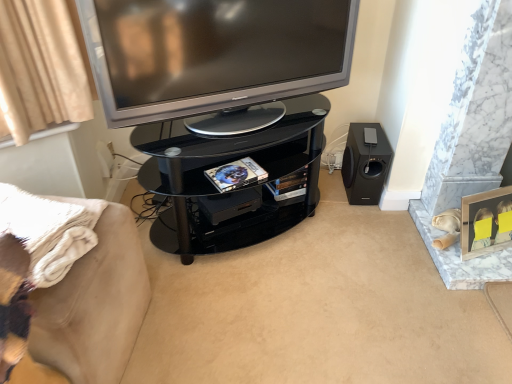
What is the approximate width of black matte speaker at lower right?

It is 33.46 centimeters.

Find the location of a particular element. black matte speaker at lower right is located at coordinates (365, 163).

Who is shorter, silver metallic television at upper center or black glass tv cabinet at center?

Standing shorter between the two is silver metallic television at upper center.

Considering the positions of objects silver metallic television at upper center and black glass tv cabinet at center in the image provided, who is more to the left, silver metallic television at upper center or black glass tv cabinet at center?

black glass tv cabinet at center.

Which is closer, (156, 45) or (313, 190)?

The point (156, 45) is in front.

Can you confirm if black glass tv cabinet at center is positioned to the left of beige fabric couch at lower left?

In fact, black glass tv cabinet at center is to the right of beige fabric couch at lower left.

Which point is more forward, (x=165, y=159) or (x=58, y=219)?

The point (x=58, y=219) is more forward.

From the picture: From a real-world perspective, is black glass tv cabinet at center physically above beige fabric couch at lower left?

Correct, in the physical world, black glass tv cabinet at center is higher than beige fabric couch at lower left.

Based on the photo, how different are the orientations of black glass tv cabinet at center and beige fabric couch at lower left in degrees?

The angular difference between black glass tv cabinet at center and beige fabric couch at lower left is 57.5 degrees.

Is black glass tv cabinet at center bigger or smaller than silver metallic television at upper center?

black glass tv cabinet at center is bigger than silver metallic television at upper center.

Is black glass tv cabinet at center aimed at silver metallic television at upper center?

No, black glass tv cabinet at center is not oriented towards silver metallic television at upper center.

What's the angular difference between black glass tv cabinet at center and silver metallic television at upper center's facing directions?

1.93 degrees separate the facing orientations of black glass tv cabinet at center and silver metallic television at upper center.

Measure the distance between black glass tv cabinet at center and silver metallic television at upper center.

They are 10.38 inches apart.

Considering the positions of point (339, 71) and point (366, 155), is point (339, 71) closer or farther from the camera than point (366, 155)?

Point (339, 71) appears to be closer to the viewer than point (366, 155).

From the picture: From a real-world perspective, is silver metallic television at upper center physically above black matte speaker at lower right?

Indeed, from a real-world perspective, silver metallic television at upper center stands above black matte speaker at lower right.

How different are the orientations of silver metallic television at upper center and black matte speaker at lower right in degrees?

The angle between the facing direction of silver metallic television at upper center and the facing direction of black matte speaker at lower right is 22.1 degrees.

From the picture: Is beige fabric couch at lower left far away from black matte speaker at lower right?

Indeed, beige fabric couch at lower left is not near black matte speaker at lower right.

How different are the orientations of beige fabric couch at lower left and black matte speaker at lower right in degrees?

The angle between the facing direction of beige fabric couch at lower left and the facing direction of black matte speaker at lower right is 81.6 degrees.

From the image's perspective, relative to black matte speaker at lower right, is beige fabric couch at lower left above or below?

Based on their image positions, beige fabric couch at lower left is located beneath black matte speaker at lower right.

How many degrees apart are the facing directions of beige fabric couch at lower left and black glass tv cabinet at center?

57.5 degrees.

Considering the points (94, 201) and (192, 144), which point is in front, point (94, 201) or point (192, 144)?

The point (94, 201) is more forward.

Identify the location of furniture that is in front of the black glass tv cabinet at center. (71, 287).

Can you confirm if beige fabric couch at lower left is smaller than black glass tv cabinet at center?

Indeed, beige fabric couch at lower left has a smaller size compared to black glass tv cabinet at center.

Which object is positioned more to the right, black glass tv cabinet at center or black matte speaker at lower right?

From the viewer's perspective, black matte speaker at lower right appears more on the right side.

Does black glass tv cabinet at center have a smaller size compared to black matte speaker at lower right?

No.

From a real-world perspective, is black glass tv cabinet at center above or below black matte speaker at lower right?

black glass tv cabinet at center is situated higher than black matte speaker at lower right in the real world.

Considering the positions of objects black glass tv cabinet at center and black matte speaker at lower right in the image provided, who is behind, black glass tv cabinet at center or black matte speaker at lower right?

Positioned behind is black matte speaker at lower right.

At what (x,y) coordinates should I click in order to perform the action: click on tv cabinet below the silver metallic television at upper center (from the image's perspective). Please return your answer as a coordinate pair (x, y). Looking at the image, I should click on (237, 188).

You are a GUI agent. You are given a task and a screenshot of the screen. Output one action in this format:
    pyautogui.click(x=<x>, y=<y>)
    Task: Click on the tv cabinet that is on the right side of beige fabric couch at lower left
    Image resolution: width=512 pixels, height=384 pixels.
    Given the screenshot: What is the action you would take?
    pyautogui.click(x=237, y=188)

Based on their spatial positions, is silver metallic television at upper center or black glass tv cabinet at center further from black matte speaker at lower right?

Among the two, silver metallic television at upper center is located further to black matte speaker at lower right.

Considering their positions, is black glass tv cabinet at center positioned closer to beige fabric couch at lower left than silver metallic television at upper center?

black glass tv cabinet at center lies closer to beige fabric couch at lower left than the other object.

Estimate the real-world distances between objects in this image. Which object is further from silver metallic television at upper center, black glass tv cabinet at center or beige fabric couch at lower left?

beige fabric couch at lower left is further to silver metallic television at upper center.

From the image, which object appears to be nearer to black glass tv cabinet at center, black matte speaker at lower right or silver metallic television at upper center?

The object closer to black glass tv cabinet at center is silver metallic television at upper center.

From the image, which object appears to be nearer to black glass tv cabinet at center, silver metallic television at upper center or beige fabric couch at lower left?

silver metallic television at upper center.

Looking at the image, which one is located further to silver metallic television at upper center, black glass tv cabinet at center or black matte speaker at lower right?

Among the two, black matte speaker at lower right is located further to silver metallic television at upper center.

When comparing their distances from black glass tv cabinet at center, does beige fabric couch at lower left or black matte speaker at lower right seem closer?

black matte speaker at lower right lies closer to black glass tv cabinet at center than the other object.

Which object lies further to the anchor point beige fabric couch at lower left, black glass tv cabinet at center or black matte speaker at lower right?

black matte speaker at lower right is further to beige fabric couch at lower left.

The height and width of the screenshot is (384, 512). In order to click on tv cabinet between beige fabric couch at lower left and black matte speaker at lower right in the horizontal direction in this screenshot , I will do `click(237, 188)`.

What are the coordinates of `television between beige fabric couch at lower left and black matte speaker at lower right` in the screenshot? It's located at (213, 53).

Locate an element on the screen. tv cabinet between silver metallic television at upper center and black matte speaker at lower right along the z-axis is located at coordinates (237, 188).

Find the location of a particular element. This screenshot has height=384, width=512. tv cabinet between silver metallic television at upper center and beige fabric couch at lower left in the up-down direction is located at coordinates (237, 188).